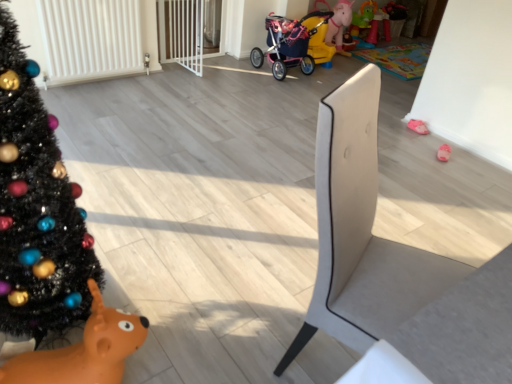
This screenshot has width=512, height=384. I want to click on vacant space to the right of pink fabric slipper at lower right, which appears as the second toy when ordered from the bottom, so click(x=434, y=133).